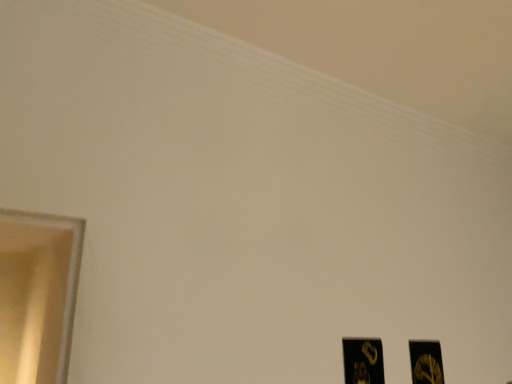
Question: Considering the positions of black matte picture frame at lower right, which ranks as the first picture frame in back-to-front order, and black matte picture frame at lower right, placed as the 1th picture frame when sorted from left to right, in the image, is black matte picture frame at lower right, which ranks as the first picture frame in back-to-front order, taller or shorter than black matte picture frame at lower right, placed as the 1th picture frame when sorted from left to right,?

Choices:
 (A) short
 (B) tall

Answer: (A)

Question: Does point (422, 357) appear closer or farther from the camera than point (376, 374)?

Choices:
 (A) farther
 (B) closer

Answer: (A)

Question: Looking at the image, does black matte picture frame at lower right, which ranks as the first picture frame in back-to-front order, seem bigger or smaller compared to black matte picture frame at lower right, the 2th picture frame positioned from the right?

Choices:
 (A) big
 (B) small

Answer: (A)

Question: From the image's perspective, is black matte picture frame at lower right, the 2th picture frame positioned from the right, positioned above or below black matte picture frame at lower right, the second picture frame viewed from the left?

Choices:
 (A) below
 (B) above

Answer: (B)

Question: In terms of width, does black matte picture frame at lower right, the second picture frame viewed from the back, look wider or thinner when compared to black matte picture frame at lower right, placed as the 2th picture frame when sorted from front to back?

Choices:
 (A) wide
 (B) thin

Answer: (B)

Question: From their relative heights in the image, would you say black matte picture frame at lower right, the second picture frame viewed from the back, is taller or shorter than black matte picture frame at lower right, the first picture frame from the right?

Choices:
 (A) tall
 (B) short

Answer: (A)

Question: From a real-world perspective, is black matte picture frame at lower right, the 2th picture frame positioned from the right, positioned above or below black matte picture frame at lower right, the second picture frame viewed from the left?

Choices:
 (A) below
 (B) above

Answer: (B)